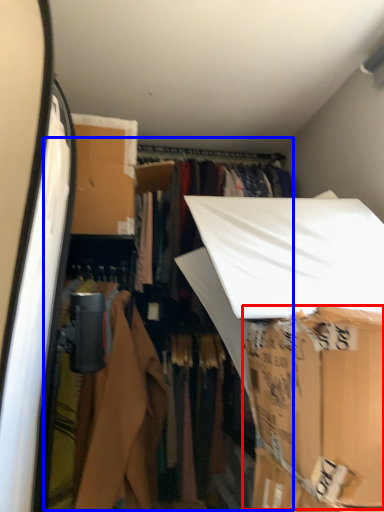
Question: Among these objects, which one is farthest to the camera, cardboard box (highlighted by a red box) or closet (highlighted by a blue box)?

Choices:
 (A) cardboard box
 (B) closet

Answer: (B)